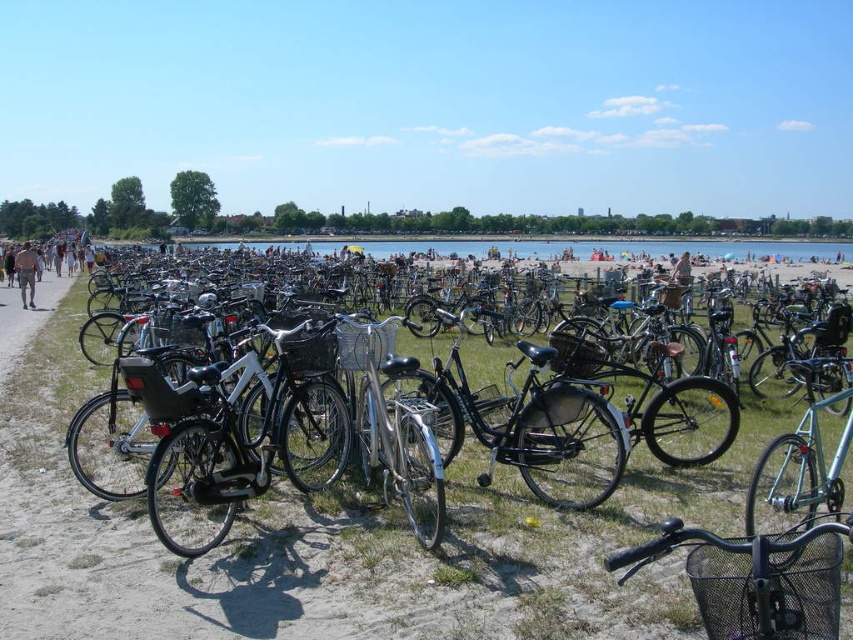
Question: Observing the image, what is the correct spatial positioning of green grass at center in reference to brown leather jacket at left?

Choices:
 (A) above
 (B) below

Answer: (B)

Question: Which object is positioned closest to the green grass at center?

Choices:
 (A) brown leather jacket at left
 (B) tan skin person at left
 (C) black matte bicycle at center

Answer: (C)

Question: From the image, what is the correct spatial relationship of green grass at center in relation to black matte bicycle at center?

Choices:
 (A) right
 (B) left

Answer: (B)

Question: Which point is farther from the camera taking this photo?

Choices:
 (A) (21, 260)
 (B) (752, 589)
 (C) (94, 499)
 (D) (28, 307)

Answer: (A)

Question: Is green grass at center positioned behind tan skin person at left?

Choices:
 (A) yes
 (B) no

Answer: (B)

Question: Which is farther from the tan skin person at left?

Choices:
 (A) brown leather jacket at left
 (B) black matte bicycle at center

Answer: (B)